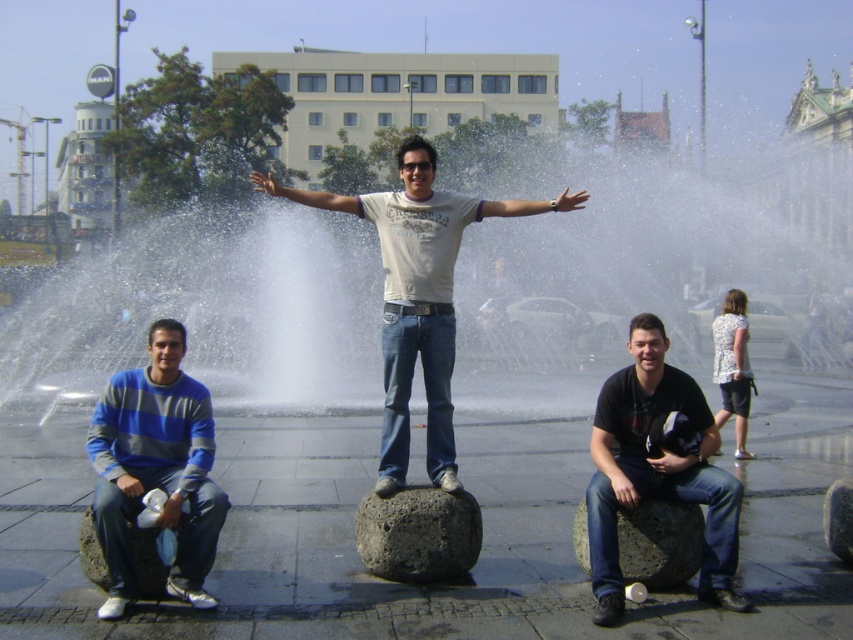
Question: Does volcanic rock stone at center appear under smooth gray rock at lower center?

Choices:
 (A) no
 (B) yes

Answer: (A)

Question: Based on their relative distances, which object is farther from the clear water at center?

Choices:
 (A) blue striped sweater at lower left
 (B) black matte shirt at center

Answer: (A)

Question: Does blue striped sweater at lower left have a lesser width compared to smooth gray rock at lower center?

Choices:
 (A) yes
 (B) no

Answer: (B)

Question: Which point is closer to the camera?

Choices:
 (A) smooth gray rock at lower center
 (B) white cotton shirt at center
 (C) blue striped sweater at lower left
 (D) volcanic rock stone at center

Answer: (C)

Question: Which of the following is the closest to the observer?

Choices:
 (A) white cotton shirt at center
 (B) smooth gray rock at lower center
 (C) clear water at center

Answer: (B)

Question: Is blue striped sweater at lower left to the left of smooth gray rock at lower center from the viewer's perspective?

Choices:
 (A) yes
 (B) no

Answer: (A)